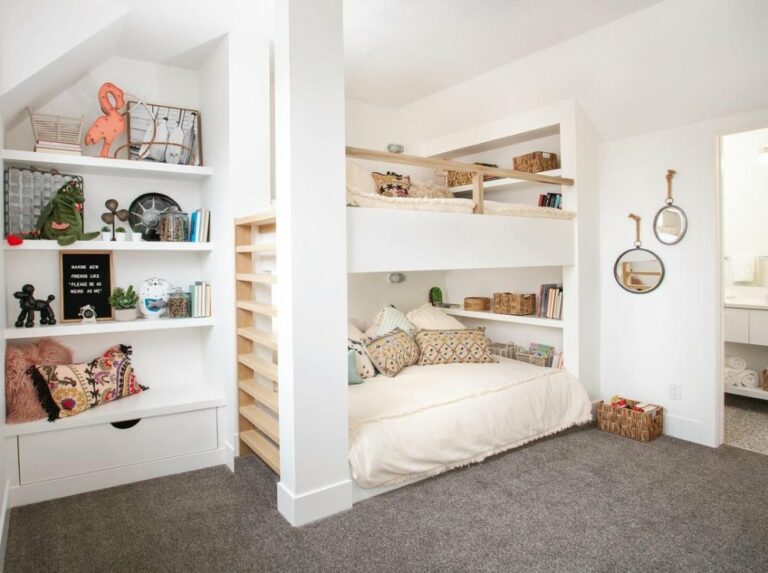
Locate an element on the screen. This screenshot has width=768, height=573. mirrors is located at coordinates (644, 274), (673, 230).